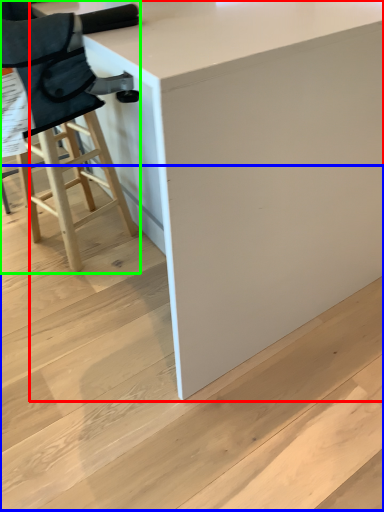
Question: Considering the real-world distances, which object is farthest from table (highlighted by a red box)? stair (highlighted by a blue box) or chair (highlighted by a green box)?

Choices:
 (A) stair
 (B) chair

Answer: (B)